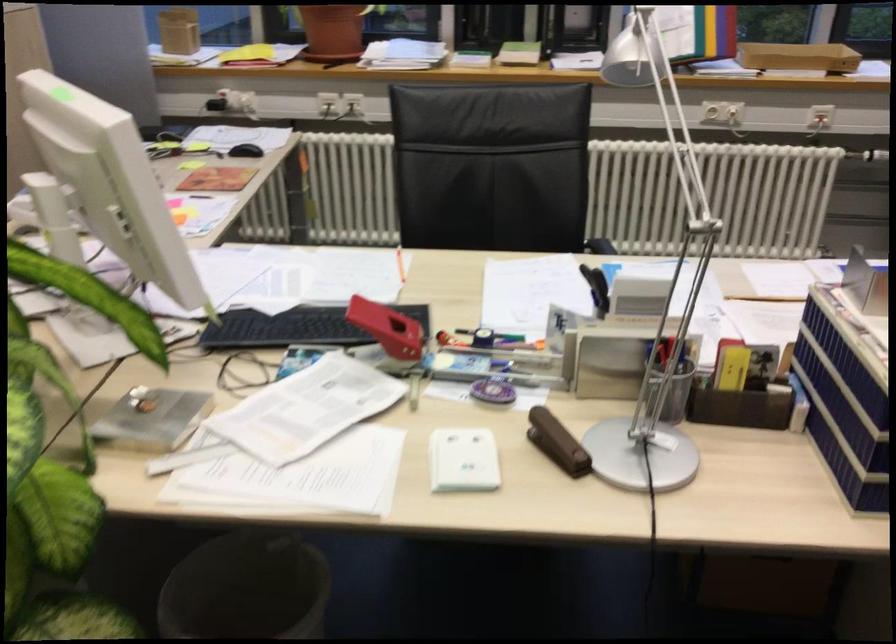
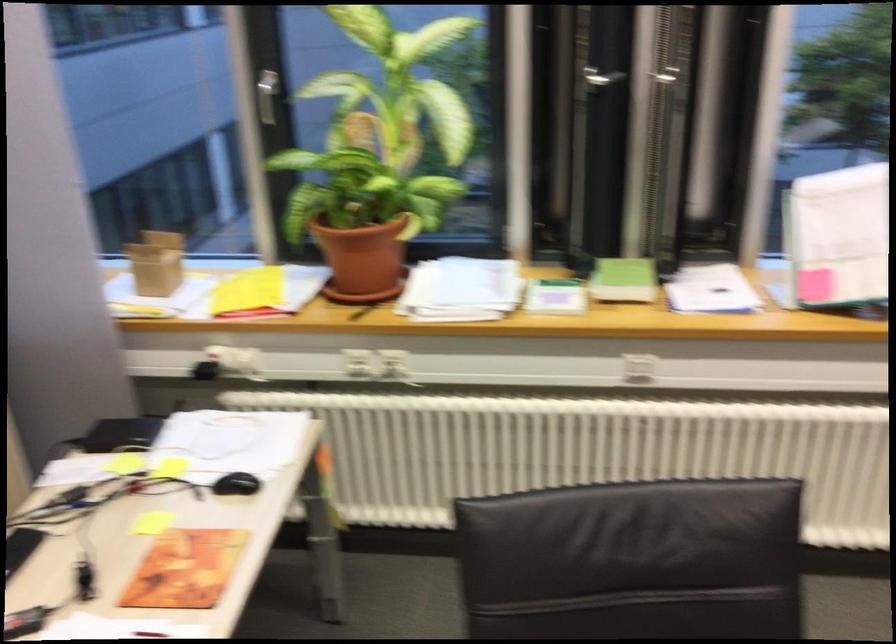
Question: Which direction would the cameraman need to move to produce the second image? Reply with the corresponding letter.

Choices:
 (A) Left
 (B) Right
 (C) Forward
 (D) Backward

Answer: (C)